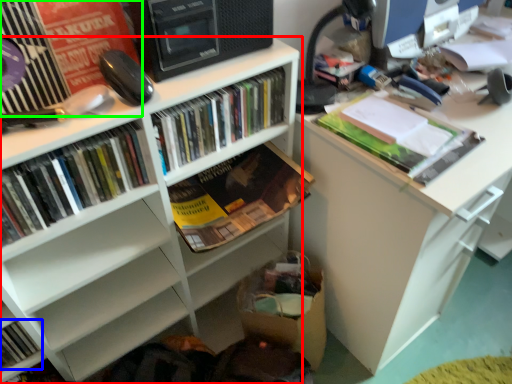
Question: Considering the real-world distances, which object is farthest from bookcase (highlighted by a red box)? book (highlighted by a blue box) or shelf (highlighted by a green box)?

Choices:
 (A) book
 (B) shelf

Answer: (B)